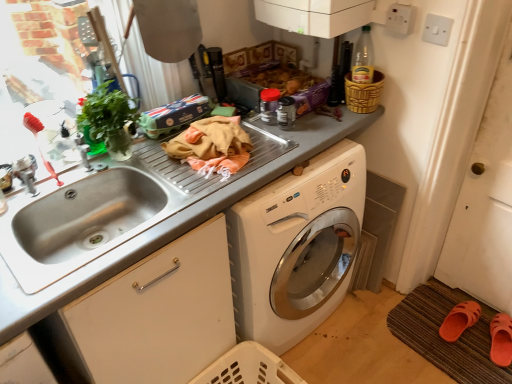
I want to click on vacant space positioned to the left of bamboo textured basket at upper right, so click(328, 115).